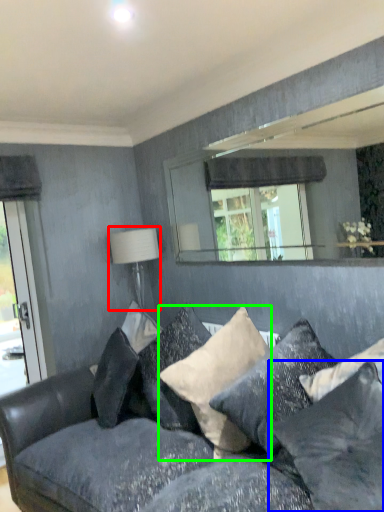
Question: Based on their relative distances, which object is nearer to table lamp (highlighted by a red box)? Choose from pillow (highlighted by a blue box) and pillow (highlighted by a green box).

Choices:
 (A) pillow
 (B) pillow

Answer: (B)